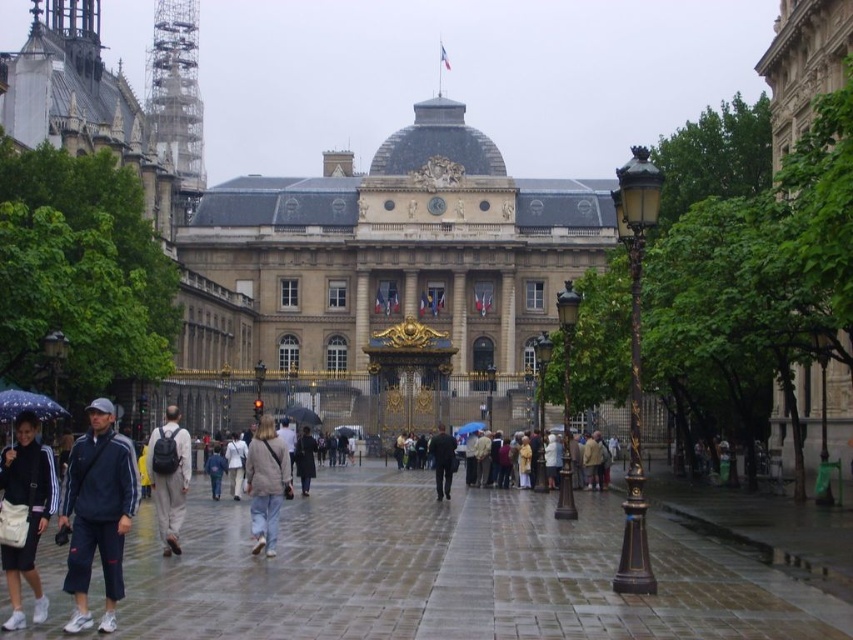
Question: Does light gray backpack at center have a smaller size compared to denim jacket at center?

Choices:
 (A) no
 (B) yes

Answer: (A)

Question: Does denim jacket at center lie behind transparent plastic umbrella at center?

Choices:
 (A) no
 (B) yes

Answer: (A)

Question: Estimate the real-world distances between objects in this image. Which object is closer to the blue matte umbrella at center?

Choices:
 (A) light beige jacket at center
 (B) light beige sweater at center
 (C) transparent plastic umbrella at center

Answer: (C)

Question: Estimate the real-world distances between objects in this image. Which object is farther from the light beige jacket at center?

Choices:
 (A) light beige sweater at center
 (B) dark blue fabric jacket at left
 (C) denim jacket at center
 (D) transparent plastic umbrella at lower left

Answer: (B)

Question: Observing the image, what is the correct spatial positioning of dark gray suit at center in reference to dark gray coat at center?

Choices:
 (A) above
 (B) below

Answer: (B)

Question: Considering the real-world distances, which object is farthest from the transparent plastic umbrella at center?

Choices:
 (A) dark blue fabric jacket at left
 (B) dark gray coat at center

Answer: (A)